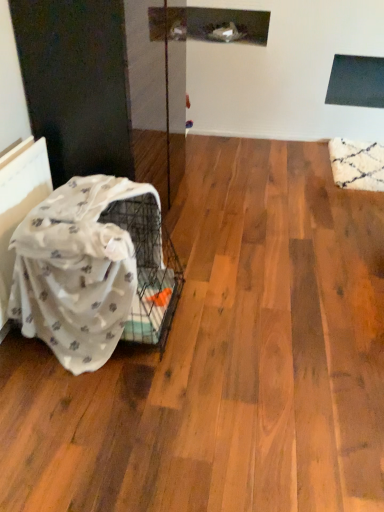
Locate an element on the screen. vacant space in front of white fleece blanket at left is located at coordinates (104, 423).